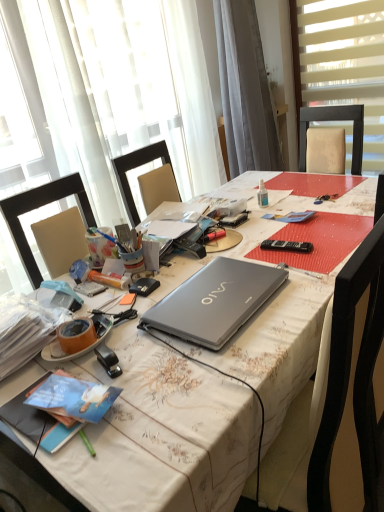
I want to click on free space behind silver metallic laptop at center, so click(220, 254).